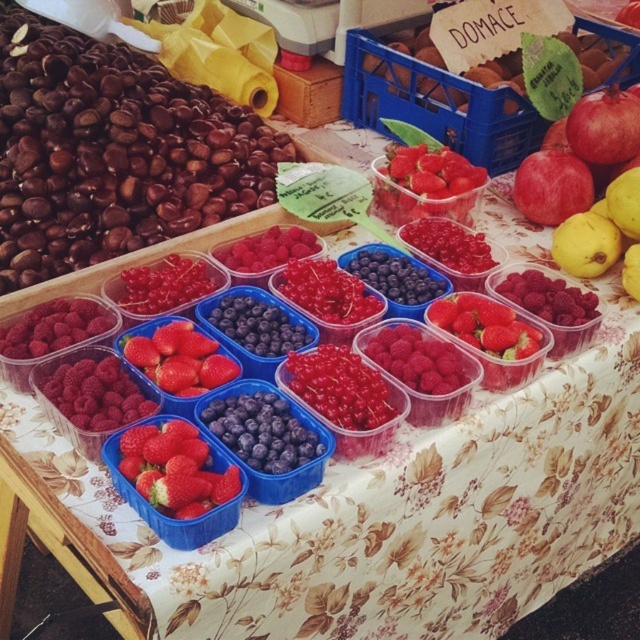
You are at a market stall and see the red matte apple at upper right and the yellow matte pear at right. Which fruit is taller?

The red matte apple at upper right is taller than the yellow matte pear at right.

In the scene shown: You are a customer at the market stall and want to place the red glossy pomegranate at upper right and the yellow matte pear at right into a single bag. Since the bag has a height limit of 20 cm, can both items fit vertically if placed one on top of the other?

The red glossy pomegranate at upper right is much taller than the yellow matte pear at right. If the pomegranate alone exceeds 20 cm in height, then both items cannot fit together in the bag. However, if the pomegranate is under 20 cm, they might fit. But since the exact heights aren

What is located at the coordinates point (586, 244) in the image?

A yellow matte pear at right is located at point (586, 244).